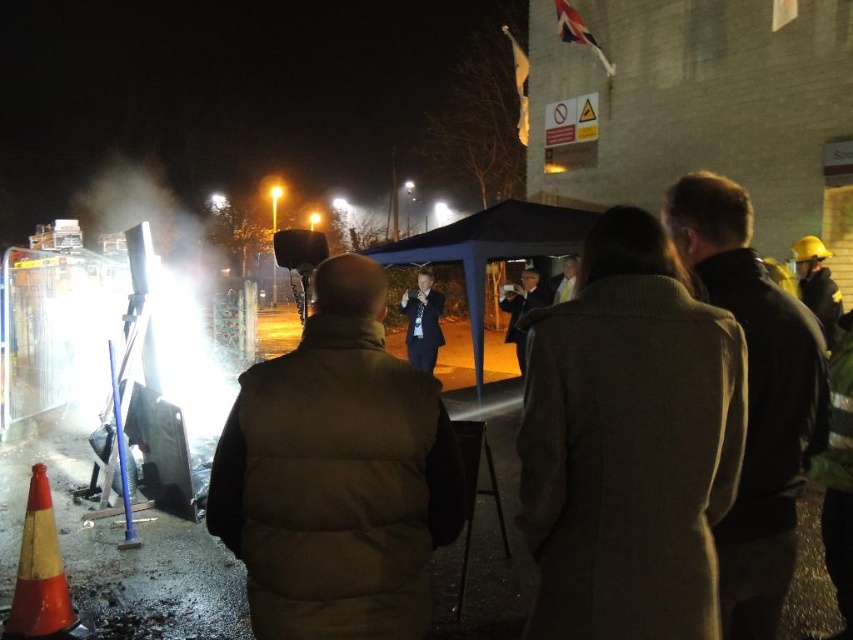
Does brown puffer vest at center appear over orange reflective cone at lower left?

Indeed, brown puffer vest at center is positioned over orange reflective cone at lower left.

Does brown puffer vest at center have a greater width compared to orange reflective cone at lower left?

Yes.

Is point (242, 403) positioned before point (47, 513)?

Yes, point (242, 403) is in front of point (47, 513).

This screenshot has height=640, width=853. Find the location of `brown puffer vest at center`. brown puffer vest at center is located at coordinates (337, 474).